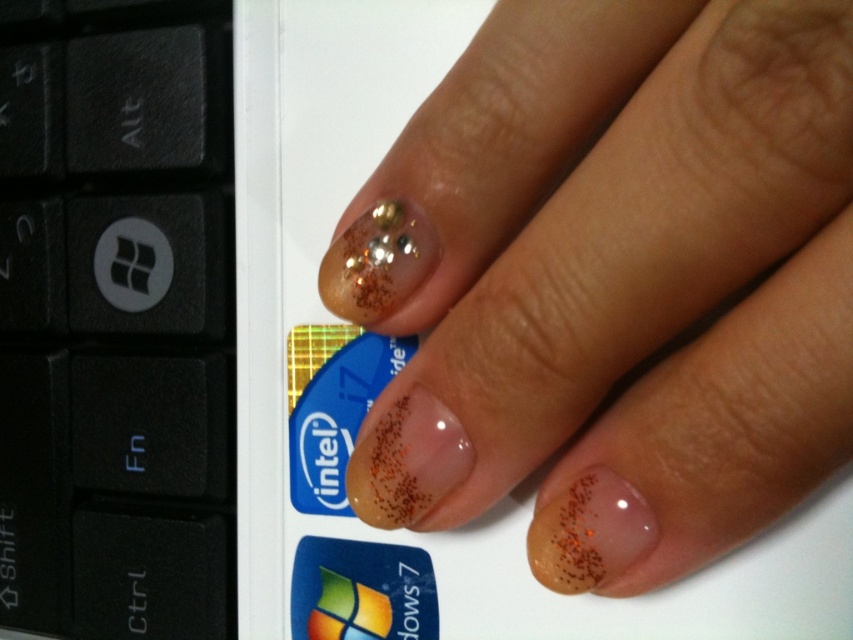
Question: Can you confirm if clear gel nails at center is positioned to the right of black plastic keyboard at left?

Choices:
 (A) no
 (B) yes

Answer: (B)

Question: Which of the following is the closest to the observer?

Choices:
 (A) clear gel nails at center
 (B) black plastic keyboard at left

Answer: (A)

Question: Is clear gel nails at center behind black plastic keyboard at left?

Choices:
 (A) yes
 (B) no

Answer: (B)

Question: Can you confirm if clear gel nails at center is wider than black plastic keyboard at left?

Choices:
 (A) no
 (B) yes

Answer: (B)

Question: Which point is farther from the camera taking this photo?

Choices:
 (A) (389, 483)
 (B) (146, 458)

Answer: (B)